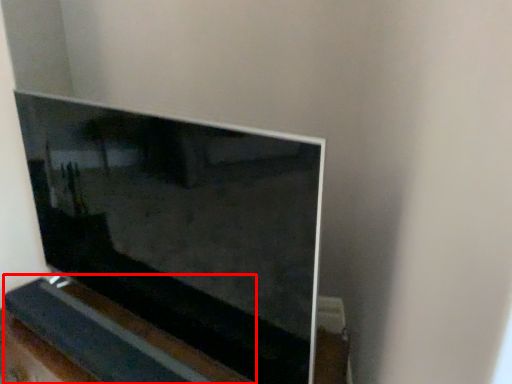
Question: From the image's perspective, where is ledge (annotated by the red box) located relative to television?

Choices:
 (A) below
 (B) above

Answer: (A)